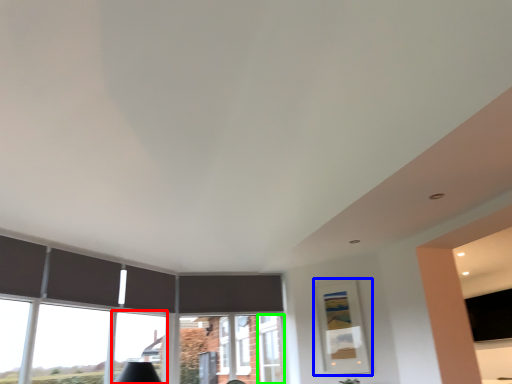
Question: Which object is positioned farthest from window (highlighted by a red box)? Select from picture frame (highlighted by a blue box) and window frame (highlighted by a green box).

Choices:
 (A) picture frame
 (B) window frame

Answer: (A)